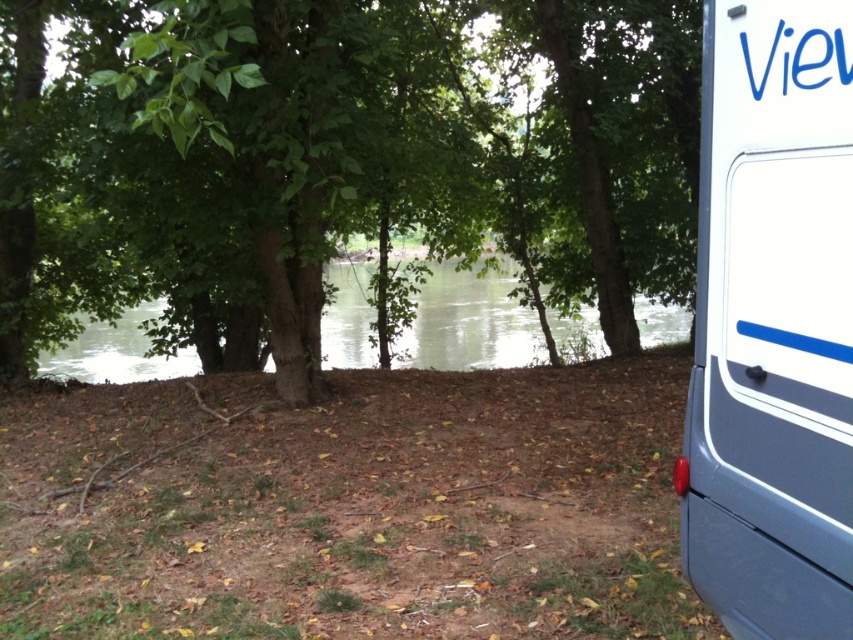
Where is `white glossy van at right`? This screenshot has width=853, height=640. white glossy van at right is located at coordinates (773, 324).

Is white glossy van at right thinner than green water at center?

Yes, white glossy van at right is thinner than green water at center.

Between point (833, 412) and point (350, 356), which one is positioned in front?

Point (833, 412)

You are a GUI agent. You are given a task and a screenshot of the screen. Output one action in this format:
    pyautogui.click(x=<x>, y=<y>)
    Task: Click on the white glossy van at right
    The height and width of the screenshot is (640, 853).
    Given the screenshot: What is the action you would take?
    pyautogui.click(x=773, y=324)

Is green leafy tree at center below white glossy van at right?

Actually, green leafy tree at center is above white glossy van at right.

How much distance is there between green leafy tree at center and white glossy van at right?

green leafy tree at center is 21.02 feet away from white glossy van at right.

What do you see at coordinates (337, 164) in the screenshot? I see `green leafy tree at center` at bounding box center [337, 164].

This screenshot has height=640, width=853. Identify the location of green leafy tree at center. (337, 164).

Is green leafy tree at center above green water at center?

Yes.

Between green leafy tree at center and green water at center, which one is positioned higher?

green leafy tree at center is above.

Describe the element at coordinates (337, 164) in the screenshot. Image resolution: width=853 pixels, height=640 pixels. I see `green leafy tree at center` at that location.

Where is `green leafy tree at center`? green leafy tree at center is located at coordinates (337, 164).